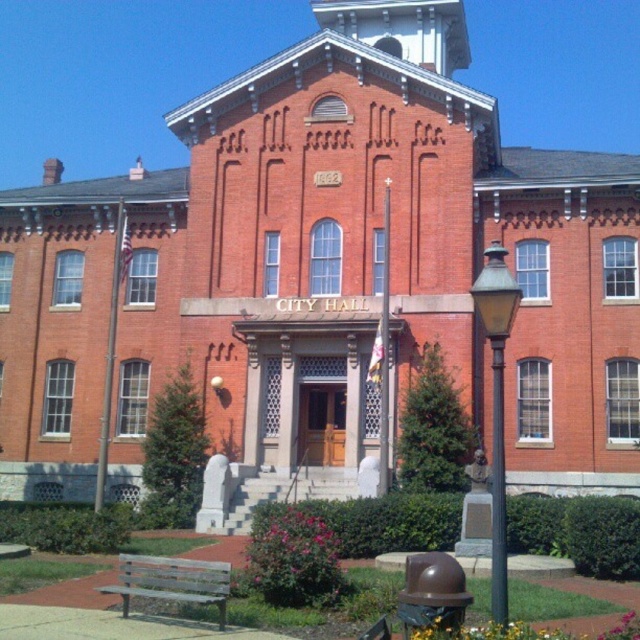
Question: Among these objects, which one is nearest to the camera?

Choices:
 (A) metallic pole at left
 (B) metallic pole at right
 (C) wooden bench at lower left
 (D) metallic flagpole at center

Answer: (B)

Question: From the image, what is the correct spatial relationship of metallic pole at right in relation to metallic pole at left?

Choices:
 (A) left
 (B) right

Answer: (B)

Question: Which object appears closest to the camera in this image?

Choices:
 (A) metallic pole at left
 (B) wooden bench at lower left
 (C) metallic flagpole at center

Answer: (B)

Question: Does wooden bench at lower left appear under metallic pole at left?

Choices:
 (A) no
 (B) yes

Answer: (B)

Question: Which of the following is the closest to the observer?

Choices:
 (A) metallic pole at right
 (B) metallic pole at left
 (C) wooden bench at lower left
 (D) matte black lamp post at lower right

Answer: (D)

Question: Where is metallic pole at right located in relation to metallic flagpole at center in the image?

Choices:
 (A) above
 (B) below

Answer: (B)